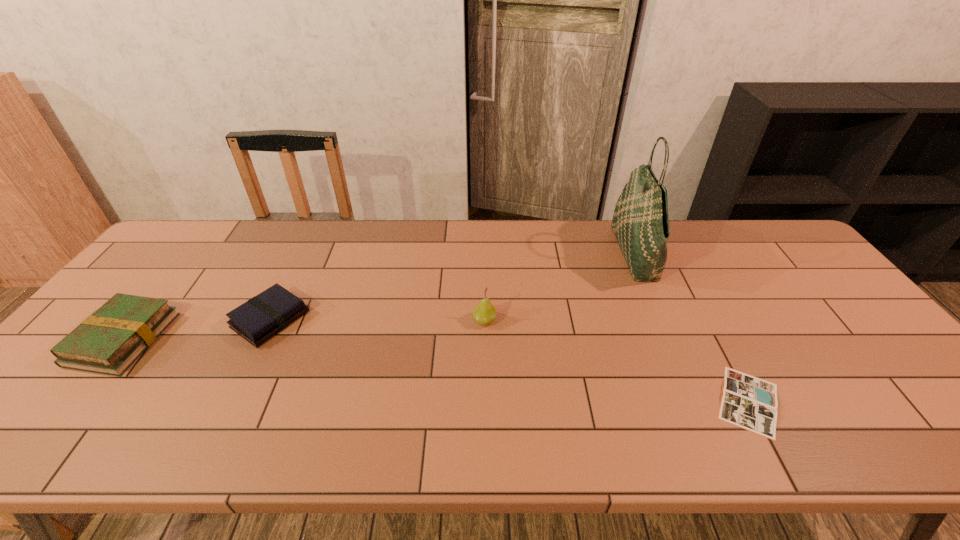
Identify the location of vacant space that is in between the third tallest object and the shortest book. (436, 370).

Where is `free space between the farthest object and the pear`? This screenshot has width=960, height=540. free space between the farthest object and the pear is located at coordinates (560, 287).

The image size is (960, 540). In order to click on the fourth closest object relative to the shortest book in this screenshot , I will do `click(109, 341)`.

Identify which object is located as the nearest to the leftmost book. Please provide its 2D coordinates. Your answer should be formatted as a tuple, i.e. [(x, y)], where the tuple contains the x and y coordinates of a point satisfying the conditions above.

[(260, 318)]

Select which book is the third closest to the fourth shortest object. Please provide its 2D coordinates. Your answer should be formatted as a tuple, i.e. [(x, y)], where the tuple contains the x and y coordinates of a point satisfying the conditions above.

[(109, 341)]

Select which book is the closest to the rightmost book. Please provide its 2D coordinates. Your answer should be formatted as a tuple, i.e. [(x, y)], where the tuple contains the x and y coordinates of a point satisfying the conditions above.

[(260, 318)]

Find the location of `free space in the image that satisfies the following two spatial constraints: 1. on the back side of the leftmost object; 2. on the right side of the third object from left to right`. free space in the image that satisfies the following two spatial constraints: 1. on the back side of the leftmost object; 2. on the right side of the third object from left to right is located at coordinates (138, 320).